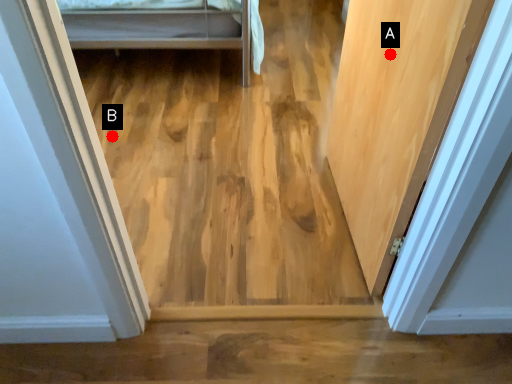
Question: Two points are circled on the image, labeled by A and B beside each circle. Which point is closer to the camera?

Choices:
 (A) A is closer
 (B) B is closer

Answer: (A)